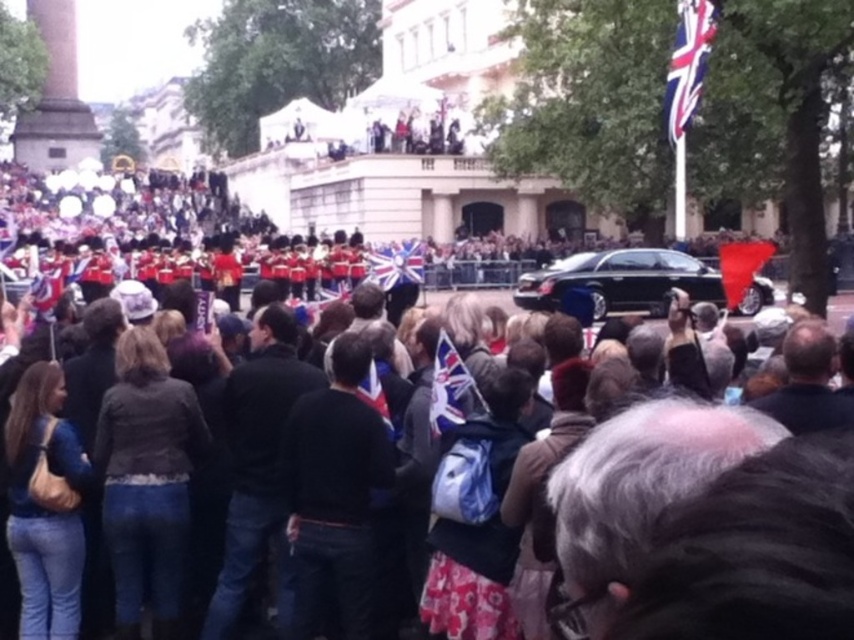
Question: Can you confirm if union jack fabric at center is smaller than union jack flag at center?

Choices:
 (A) no
 (B) yes

Answer: (A)

Question: Observing the image, what is the correct spatial positioning of dark brown leather jacket at center in reference to black glossy car at center?

Choices:
 (A) above
 (B) below

Answer: (A)

Question: Is red fabric flag at right below union jack fabric at center?

Choices:
 (A) yes
 (B) no

Answer: (B)

Question: Among these objects, which one is nearest to the camera?

Choices:
 (A) union jack fabric at center
 (B) red fabric flag at right

Answer: (A)

Question: Among these points, which one is farthest from the camera?

Choices:
 (A) (41, 291)
 (B) (753, 262)
 (C) (695, 22)

Answer: (B)

Question: Among these points, which one is nearest to the camera?

Choices:
 (A) (547, 292)
 (B) (455, 384)
 (C) (396, 266)

Answer: (B)